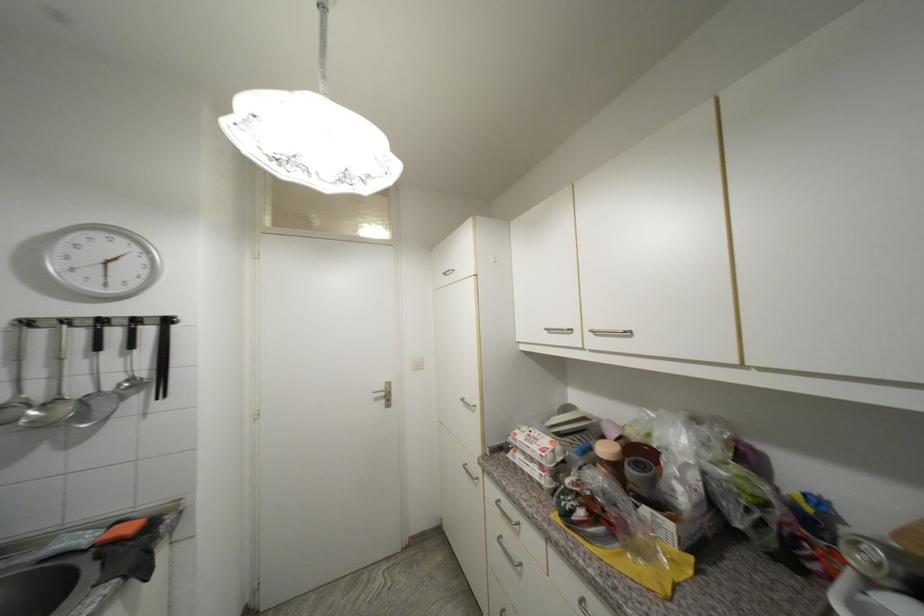
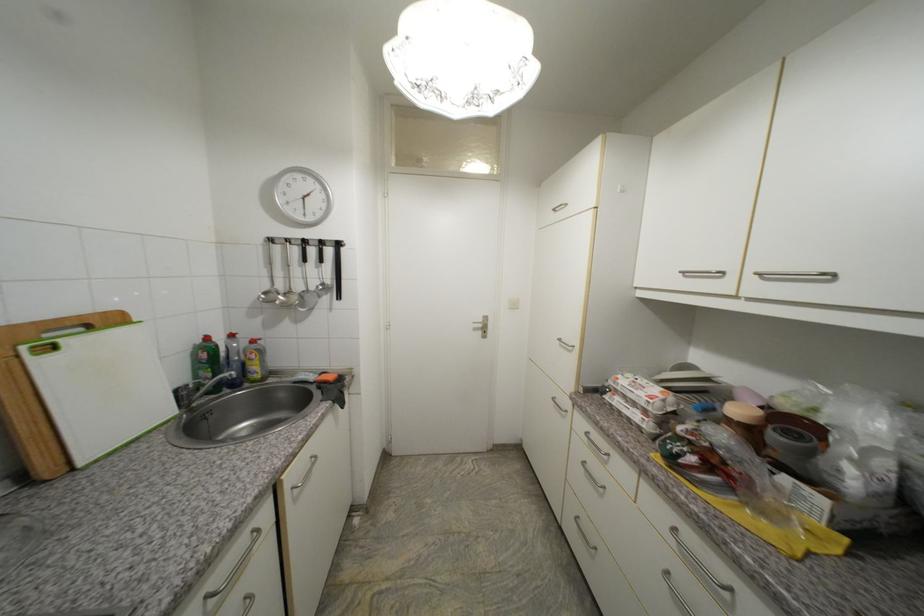
Locate, in the second image, the point that corresponds to the point at 45,400 in the first image.

(287, 292)